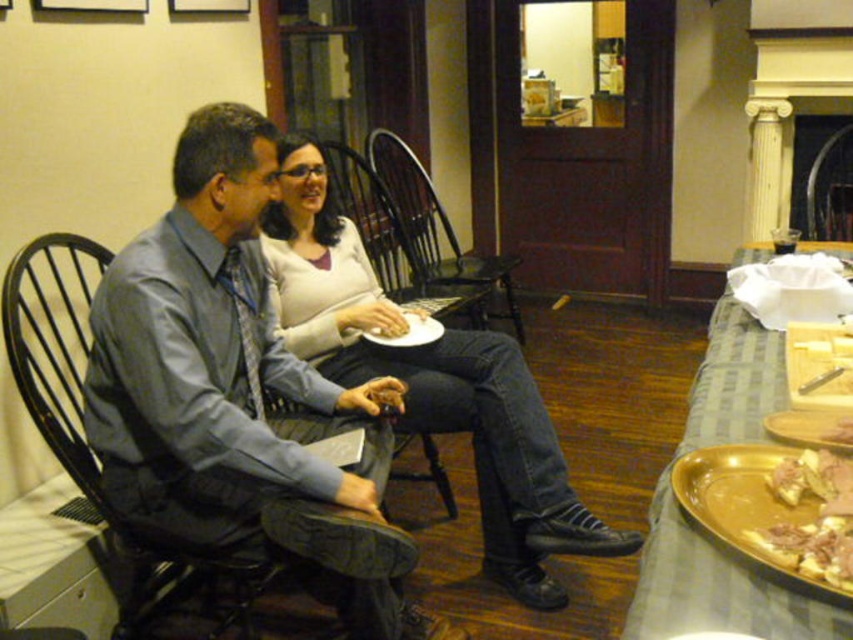
Which is more to the right, black wood chair at center or gold metallic platter at lower right?

gold metallic platter at lower right

Identify the location of black wood chair at center. (437, 230).

You are a GUI agent. You are given a task and a screenshot of the screen. Output one action in this format:
    pyautogui.click(x=<x>, y=<y>)
    Task: Click on the black wood chair at center
    This screenshot has height=640, width=853.
    Given the screenshot: What is the action you would take?
    pyautogui.click(x=437, y=230)

Does black wood chair at left have a lesser width compared to golden brown crispy bread at lower right?

No, black wood chair at left is not thinner than golden brown crispy bread at lower right.

Between point (42, 413) and point (846, 435), which one is positioned behind?

Positioned behind is point (42, 413).

Find the location of a particular element. This screenshot has height=640, width=853. black wood chair at left is located at coordinates (90, 449).

Does matte white sweater at center appear under black wood chair at left?

No.

Is matte white sweater at center to the left of black wood chair at left from the viewer's perspective?

Incorrect, matte white sweater at center is not on the left side of black wood chair at left.

The image size is (853, 640). I want to click on matte white sweater at center, so click(x=430, y=381).